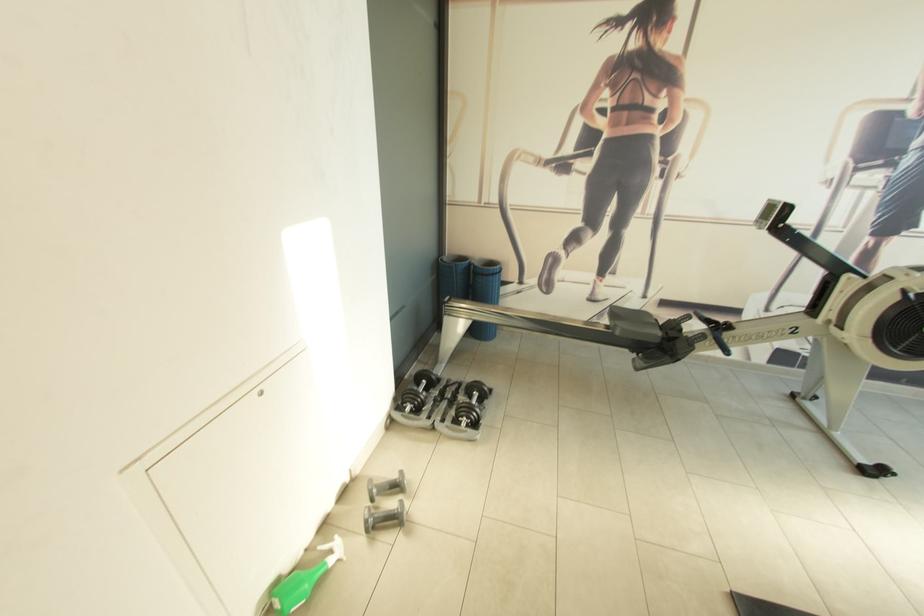
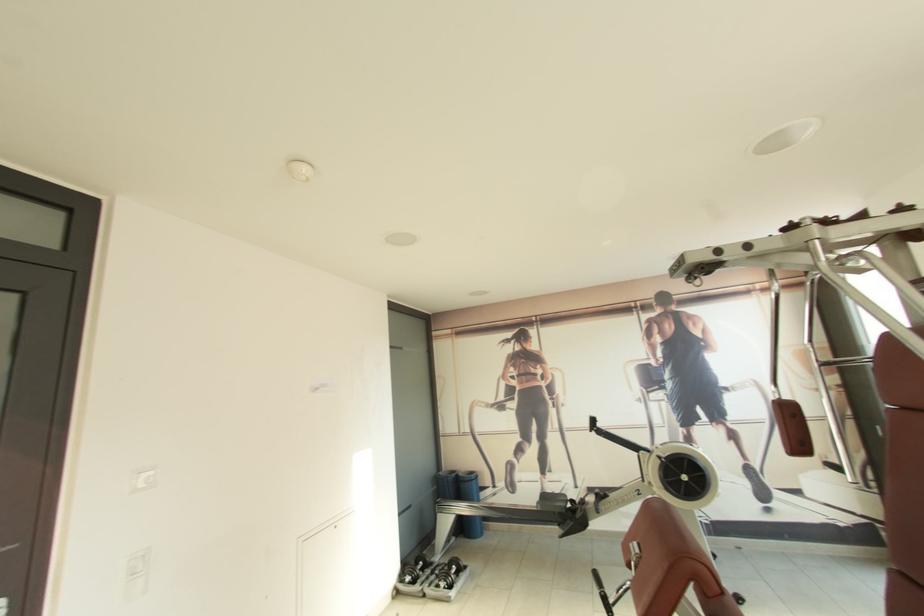
Where in the second image is the point corresponding to (x=424, y=402) from the first image?

(419, 575)